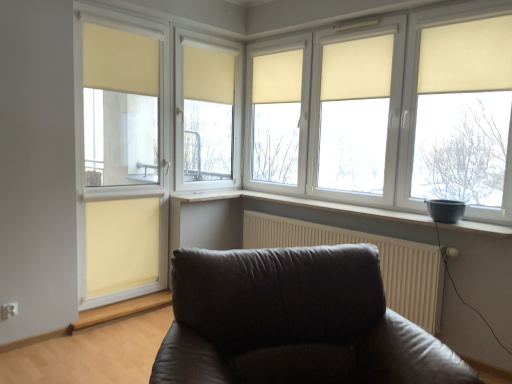
Question: Is beige fabric curtain at center, acting as the third curtain starting from the right, far away from beige fabric curtain at upper center, the 5th curtain positioned from the left?

Choices:
 (A) yes
 (B) no

Answer: (B)

Question: Is beige fabric curtain at center, acting as the 4th curtain starting from the left, not within beige fabric curtain at upper center, the 5th curtain positioned from the left?

Choices:
 (A) yes
 (B) no

Answer: (A)

Question: Is beige fabric curtain at center, acting as the 4th curtain starting from the left, facing away from beige fabric curtain at upper center, the 2th curtain in the right-to-left sequence?

Choices:
 (A) no
 (B) yes

Answer: (A)

Question: Is the position of beige fabric curtain at center, acting as the 4th curtain starting from the left, more distant than that of beige fabric curtain at upper center, the 5th curtain positioned from the left?

Choices:
 (A) no
 (B) yes

Answer: (B)

Question: Can you confirm if beige fabric curtain at center, acting as the 4th curtain starting from the left, is taller than beige fabric curtain at upper center, the 2th curtain in the right-to-left sequence?

Choices:
 (A) yes
 (B) no

Answer: (A)

Question: Is beige fabric curtain at center, acting as the third curtain starting from the right, next to beige fabric curtain at upper center, the 5th curtain positioned from the left?

Choices:
 (A) no
 (B) yes

Answer: (A)

Question: Does translucent beige glass door at left appear on the left side of white matte window sill at center?

Choices:
 (A) no
 (B) yes

Answer: (B)

Question: Is the depth of translucent beige glass door at left less than that of white matte window sill at center?

Choices:
 (A) yes
 (B) no

Answer: (B)

Question: Considering the relative sizes of translucent beige glass door at left and white matte window sill at center in the image provided, is translucent beige glass door at left smaller than white matte window sill at center?

Choices:
 (A) no
 (B) yes

Answer: (A)

Question: Is translucent beige glass door at left aimed at white matte window sill at center?

Choices:
 (A) no
 (B) yes

Answer: (A)

Question: From a real-world perspective, is translucent beige glass door at left positioned over white matte window sill at center based on gravity?

Choices:
 (A) yes
 (B) no

Answer: (A)

Question: Can you confirm if translucent beige glass door at left is wider than white matte window sill at center?

Choices:
 (A) yes
 (B) no

Answer: (B)

Question: Is white textured radiator at lower right completely or partially outside of translucent beige glass door at left?

Choices:
 (A) no
 (B) yes

Answer: (B)